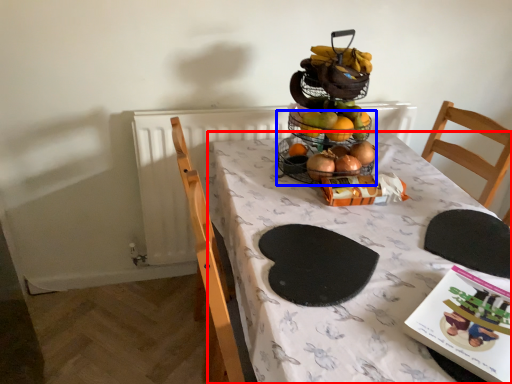
Question: Which point is further to the camera, table (highlighted by a red box) or basket (highlighted by a blue box)?

Choices:
 (A) table
 (B) basket

Answer: (B)